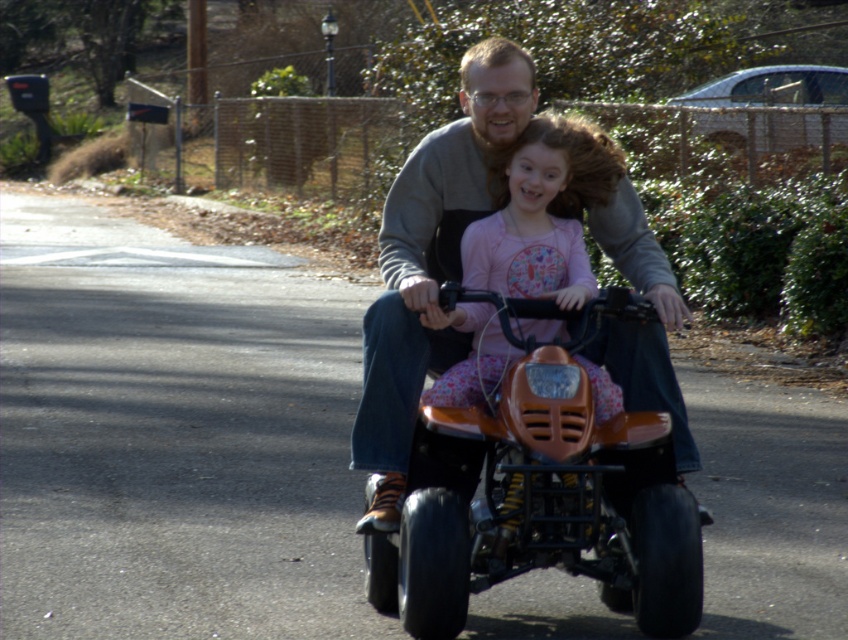
In the scene shown: You are a photographer standing at the origin point of the image coordinate system. You want to place a matte gray sweatshirt at center in your photo. Where should you place it in terms of coordinates?

The matte gray sweatshirt at center should be placed at coordinates point (x=431, y=259).

You are a photographer standing 12 inches away from the quad bike. You want to take a photo of both the matte gray sweatshirt at center and the pink fabric dress at center in the same frame. Can you position yourself so that both objects are within your camera view without moving the quad bike?

The matte gray sweatshirt at center is 10.31 inches away from the pink fabric dress at center. Since you are 12 inches away from the quad bike, the distance between the two objects is less than your distance from them. Therefore, you can position yourself so that both the matte gray sweatshirt at center and the pink fabric dress at center are within your camera view without moving the quad bike.

You are a photographer trying to capture the perfect shot of the matte gray sweatshirt at center and the pink fabric dress at center. Since you want to emphasize the size difference between them, which clothing item should you zoom in on to make the size difference more apparent?

The matte gray sweatshirt at center has a lesser width compared to the pink fabric dress at center, so you should zoom in on the pink fabric dress at center to highlight its larger size.